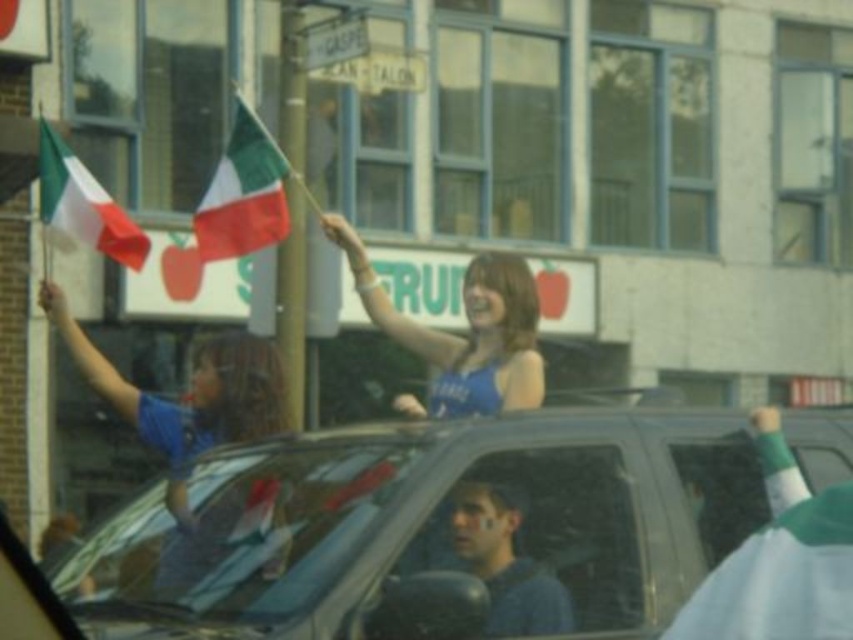
Question: Is metallic silver car at center above blue fabric dress at center?

Choices:
 (A) yes
 (B) no

Answer: (B)

Question: Which object is closer to the camera taking this photo?

Choices:
 (A) smooth blue shirt at center
 (B) matte fabric flag at upper center
 (C) matte fabric flag at left
 (D) metallic silver car at center

Answer: (D)

Question: Which point is farther to the camera?

Choices:
 (A) (140, 529)
 (B) (125, 211)

Answer: (B)

Question: Which object is farther from the camera taking this photo?

Choices:
 (A) matte blue shirt at upper left
 (B) matte fabric flag at upper center
 (C) transparent plastic window at center
 (D) smooth blue shirt at center

Answer: (B)

Question: Can you confirm if metallic silver car at center is positioned above matte blue shirt at upper left?

Choices:
 (A) yes
 (B) no

Answer: (B)

Question: Does metallic silver car at center lie behind blue fabric dress at center?

Choices:
 (A) no
 (B) yes

Answer: (A)